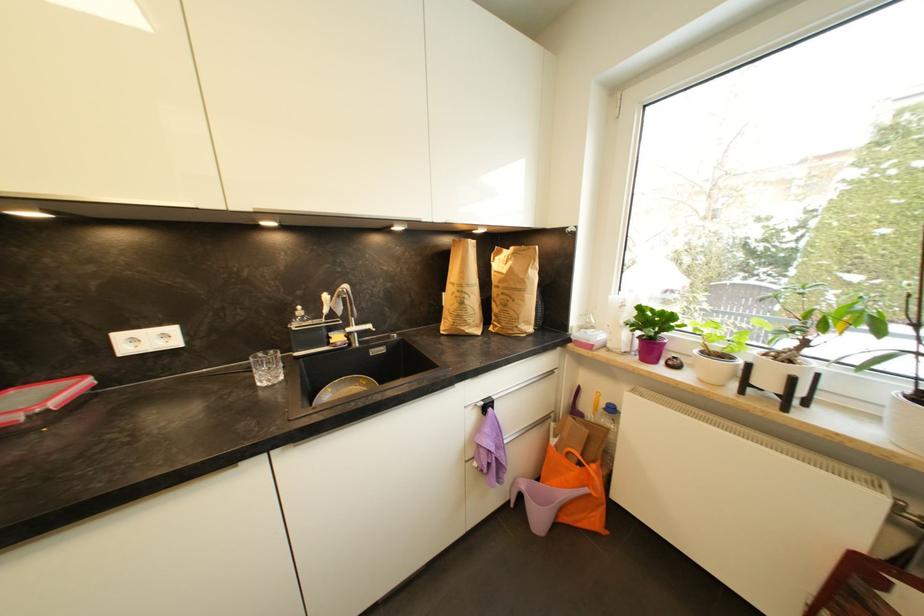
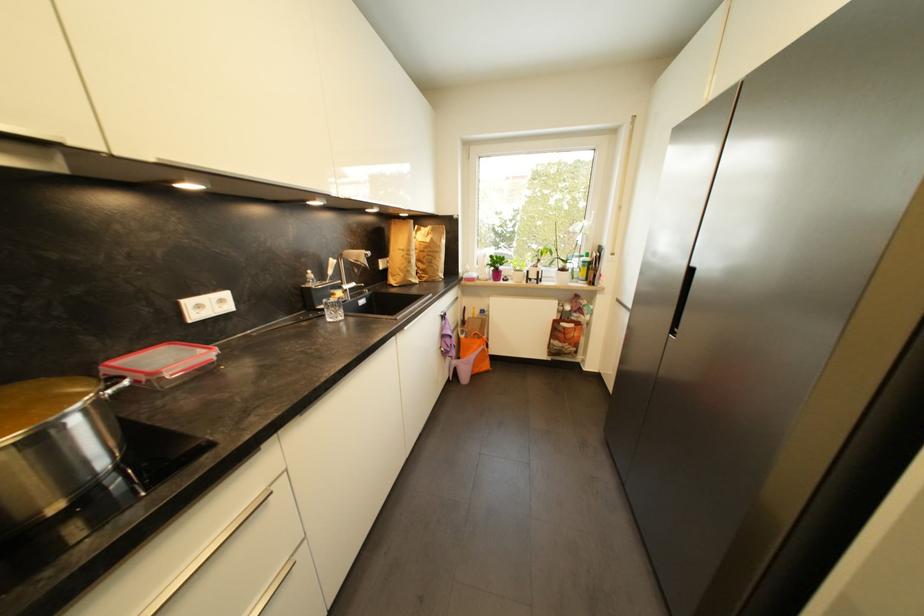
Find the pixel in the second image that matches (557,443) in the first image.

(468, 339)